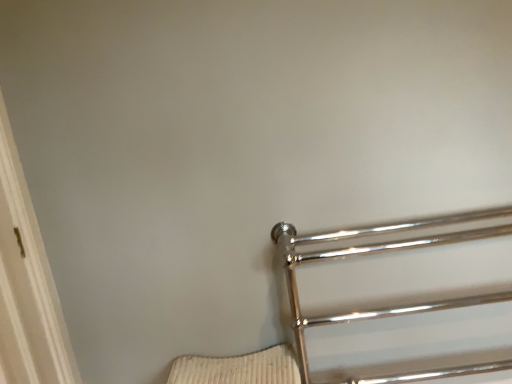
The width and height of the screenshot is (512, 384). Identify the location of polished chrome towel rack at right. (376, 253).

This screenshot has width=512, height=384. What do you see at coordinates (376, 253) in the screenshot? I see `polished chrome towel rack at right` at bounding box center [376, 253].

Locate an element on the screen. polished chrome towel rack at right is located at coordinates (376, 253).